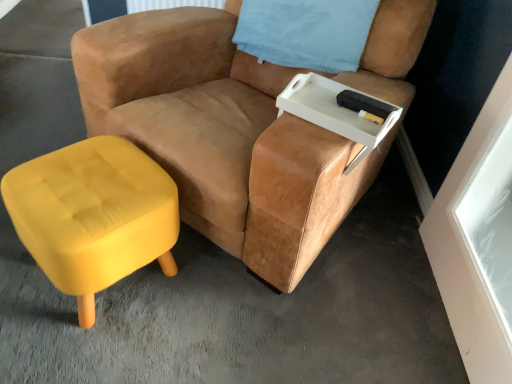
Image resolution: width=512 pixels, height=384 pixels. Find the location of `unoccupied area in front of velvet yellow ottoman at lower left`. unoccupied area in front of velvet yellow ottoman at lower left is located at coordinates (83, 350).